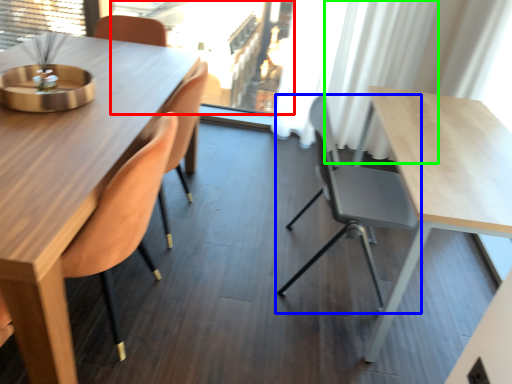
Question: Which object is the farthest from window screen (highlighted by a red box)? Choose among these: chair (highlighted by a blue box) or curtain (highlighted by a green box).

Choices:
 (A) chair
 (B) curtain

Answer: (A)